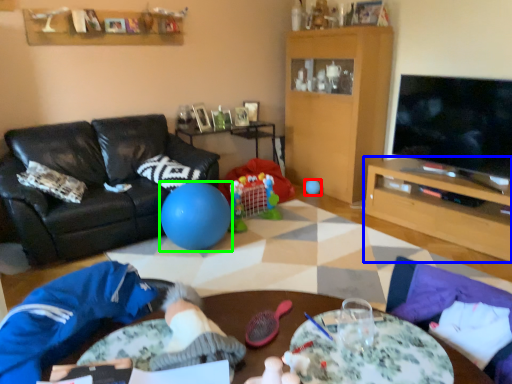
Question: Estimate the real-world distances between objects in this image. Which object is closer to ball (highlighted by a red box), table (highlighted by a blue box) or ball (highlighted by a green box)?

Choices:
 (A) table
 (B) ball

Answer: (A)